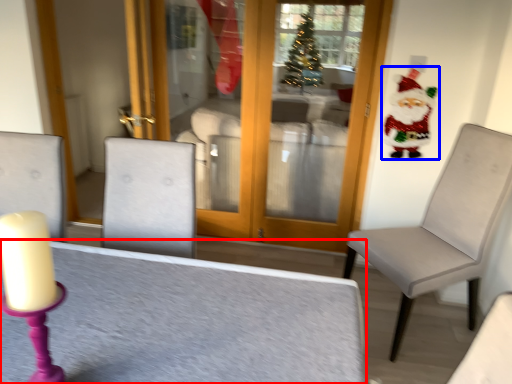
Question: Among these objects, which one is nearest to the camera, table (highlighted by a red box) or santa claus (highlighted by a blue box)?

Choices:
 (A) table
 (B) santa claus

Answer: (A)